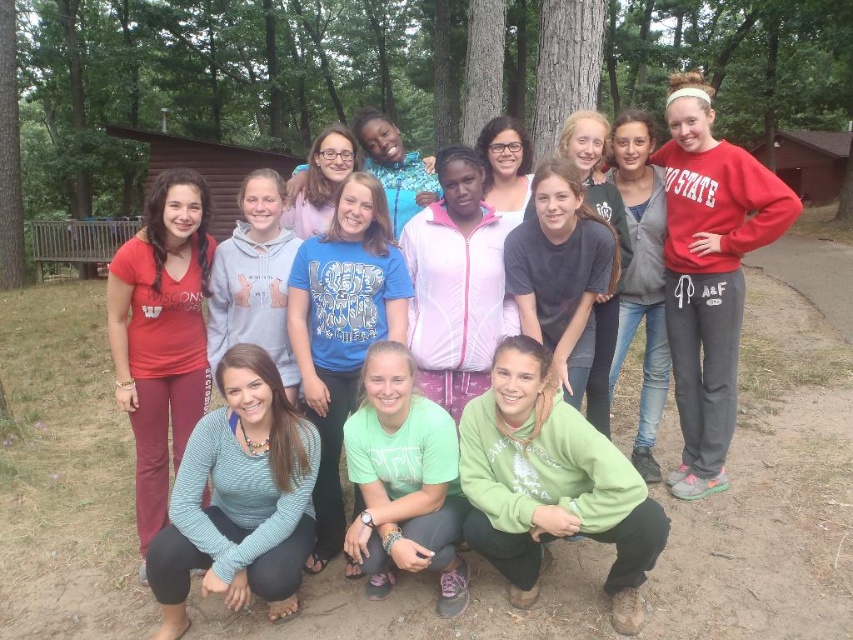
Between point (302, 547) and point (357, 289), which one is positioned behind?

Positioned behind is point (357, 289).

The width and height of the screenshot is (853, 640). I want to click on striped knit sweater at lower center, so click(x=239, y=499).

Is blue cotton shirt at center shorter than matte gray hoodie at center?

Yes.

Which is behind, point (370, 225) or point (625, 314)?

Positioned behind is point (625, 314).

You are a GUI agent. You are given a task and a screenshot of the screen. Output one action in this format:
    pyautogui.click(x=<x>, y=<y>)
    Task: Click on the blue cotton shirt at center
    This screenshot has width=853, height=640.
    Given the screenshot: What is the action you would take?
    pyautogui.click(x=341, y=328)

Does green fleece sweatshirt at lower center appear on the right side of matte gray hoodie at center?

No, green fleece sweatshirt at lower center is not to the right of matte gray hoodie at center.

Which is above, green fleece sweatshirt at lower center or matte gray hoodie at center?

matte gray hoodie at center is higher up.

You are a GUI agent. You are given a task and a screenshot of the screen. Output one action in this format:
    pyautogui.click(x=<x>, y=<y>)
    Task: Click on the green fleece sweatshirt at lower center
    This screenshot has height=640, width=853.
    Given the screenshot: What is the action you would take?
    pyautogui.click(x=550, y=483)